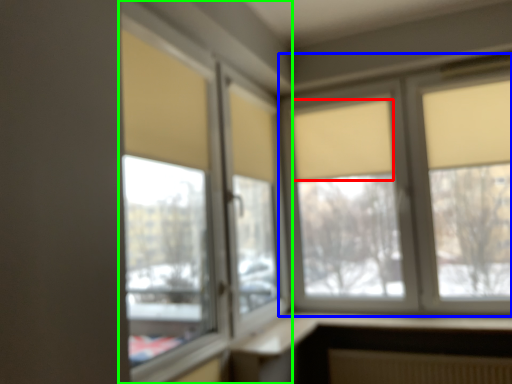
Question: Which object is the farthest from curtain (highlighted by a red box)? Choose among these: window (highlighted by a blue box) or window (highlighted by a green box).

Choices:
 (A) window
 (B) window

Answer: (B)